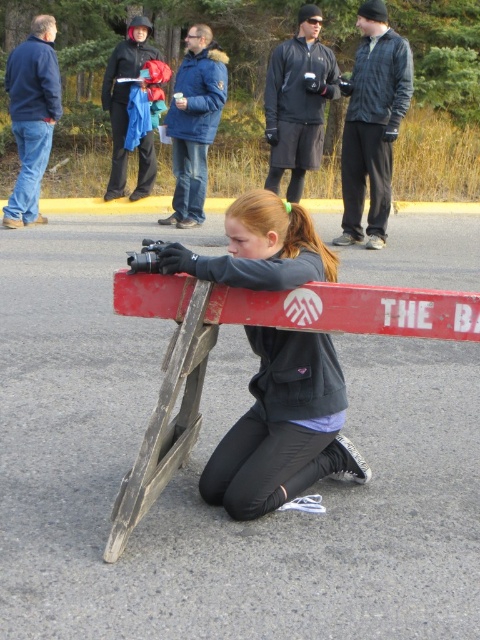
You are standing at point [315,60] and want to walk to point [320,365]. Which direction should you move in?

You should move forward because point [320,365] is in front of point [315,60].

You are a photographer trying to decide which jacket to wear for an outdoor shoot. You notice two jackets in the scene, the dark gray jacket at upper center and the matte black jacket at upper center. Which jacket is bigger in size?

The dark gray jacket at upper center has a larger size compared to the matte black jacket at upper center, so you should choose the dark gray jacket at upper center for a more spacious fit.